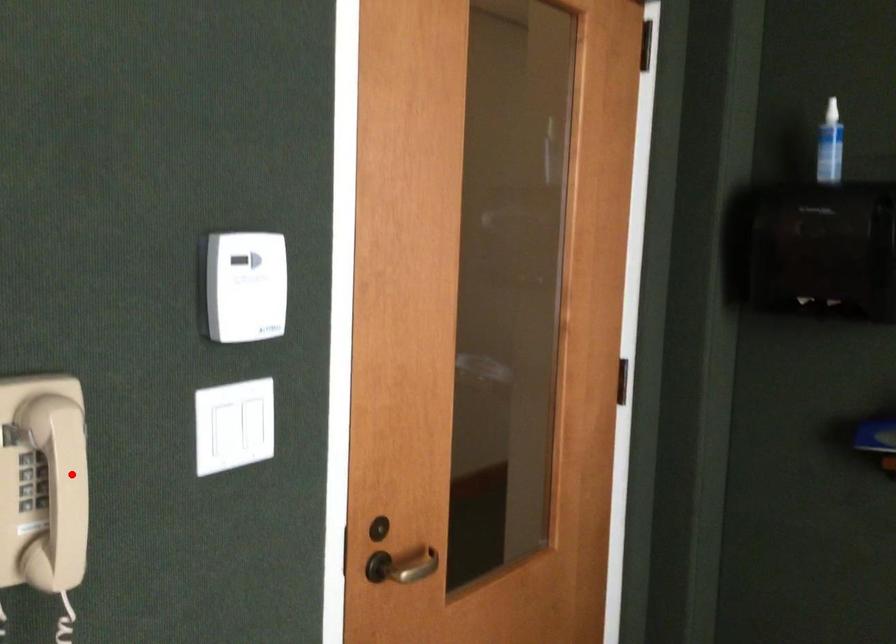
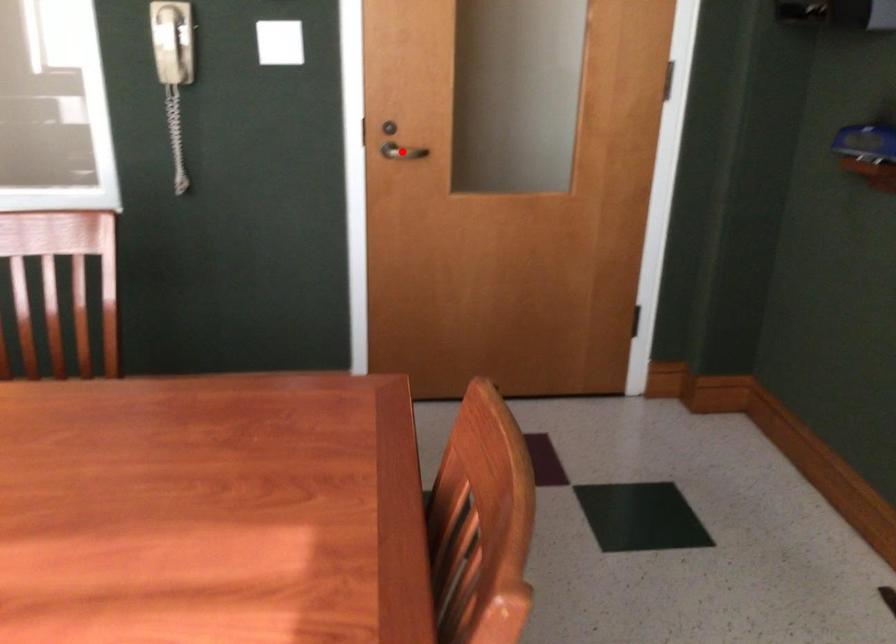
I am providing you with two images of the same scene from different viewpoints. A red point is marked on the first image and another point is marked on the second image. Do the highlighted points in image1 and image2 indicate the same real-world spot?

No